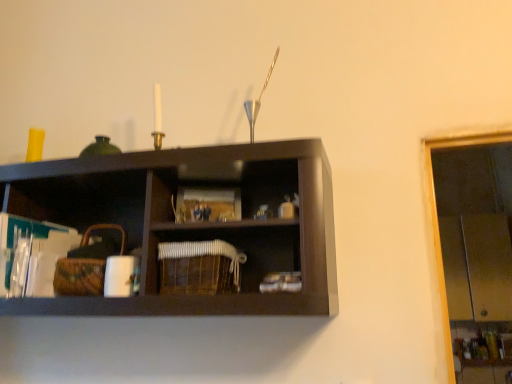
Question: Would you say woven brown basket at left, the second basket positioned from the right, is to the left or to the right of woven brown basket at center, the 1th basket positioned from the right, in the picture?

Choices:
 (A) right
 (B) left

Answer: (B)

Question: From the image's perspective, is woven brown basket at left, the first basket positioned from the left, above or below woven brown basket at center, the 1th basket positioned from the right?

Choices:
 (A) below
 (B) above

Answer: (B)

Question: Is woven brown basket at left, the second basket positioned from the right, in front of or behind woven brown basket at center, the 2th basket in the left-to-right sequence, in the image?

Choices:
 (A) front
 (B) behind

Answer: (B)

Question: Considering the positions of point (181, 248) and point (102, 276), is point (181, 248) closer or farther from the camera than point (102, 276)?

Choices:
 (A) closer
 (B) farther

Answer: (A)

Question: Is woven brown basket at center, the 2th basket in the left-to-right sequence, situated inside woven brown basket at left, the first basket positioned from the left, or outside?

Choices:
 (A) outside
 (B) inside

Answer: (A)

Question: Based on their positions, is woven brown basket at center, the 2th basket in the left-to-right sequence, located to the left or right of woven brown basket at left, the second basket positioned from the right?

Choices:
 (A) right
 (B) left

Answer: (A)

Question: Considering their positions, is woven brown basket at center, the 2th basket in the left-to-right sequence, located in front of or behind woven brown basket at left, the first basket positioned from the left?

Choices:
 (A) behind
 (B) front

Answer: (B)